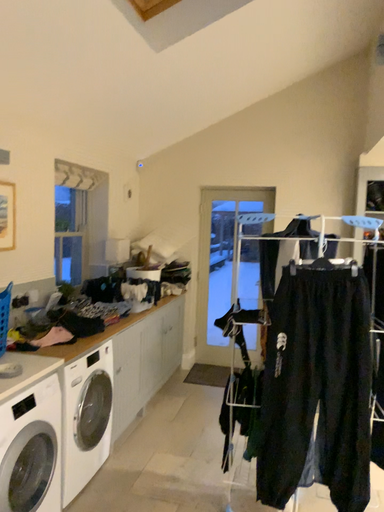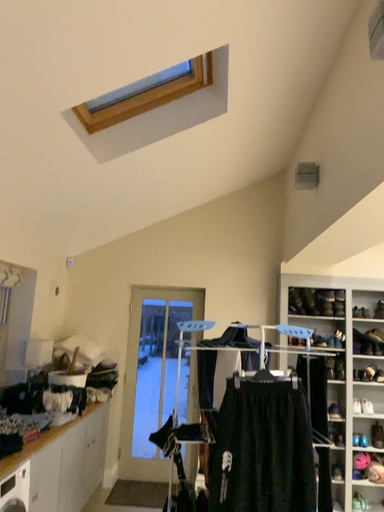
Question: Which way did the camera rotate in the video?

Choices:
 (A) rotated right
 (B) rotated left

Answer: (A)